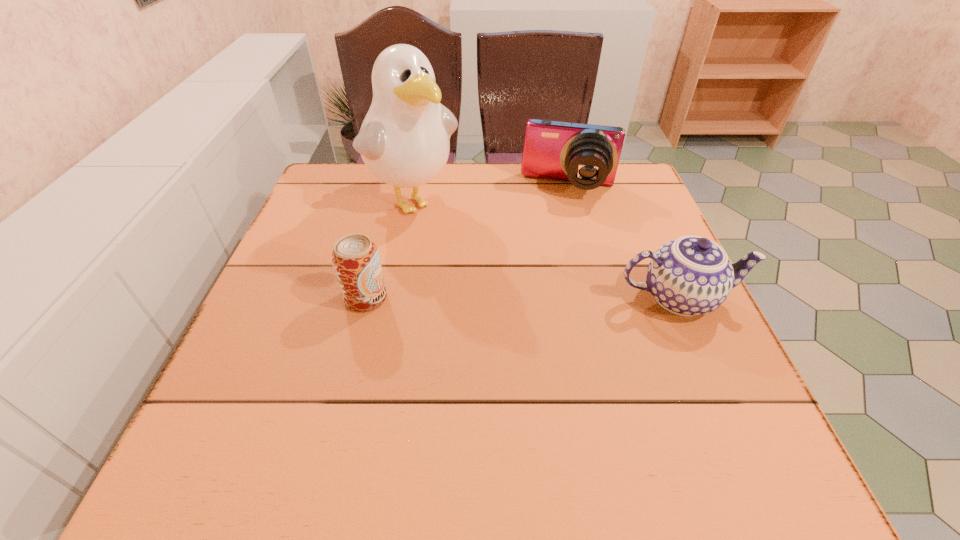
This screenshot has height=540, width=960. I want to click on vacant space at the right edge of the desktop, so click(x=620, y=298).

In the image, there is a desktop. At what (x,y) coordinates should I click in order to perform the action: click on vacant area at the far left corner. Please return your answer as a coordinate pair (x, y). Looking at the image, I should click on (367, 200).

Find the location of a particular element. The image size is (960, 540). free space between the chinaware and the gull is located at coordinates (545, 248).

The height and width of the screenshot is (540, 960). Find the location of `empty location between the gull and the camera`. empty location between the gull and the camera is located at coordinates (490, 193).

Find the location of `free spot between the camera and the chinaware`. free spot between the camera and the chinaware is located at coordinates (624, 243).

At what (x,y) coordinates should I click in order to perform the action: click on free spot between the gull and the chinaware. Please return your answer as a coordinate pair (x, y). The height and width of the screenshot is (540, 960). Looking at the image, I should click on (545, 248).

Locate an element on the screen. free space between the beer can and the chinaware is located at coordinates (522, 298).

At what (x,y) coordinates should I click in order to perform the action: click on free point between the camera and the gull. Please return your answer as a coordinate pair (x, y). Looking at the image, I should click on (490, 193).

The image size is (960, 540). I want to click on free space between the chinaware and the camera, so click(624, 243).

In order to click on vacant space that is in between the camera and the tallest object in this screenshot , I will do `click(490, 193)`.